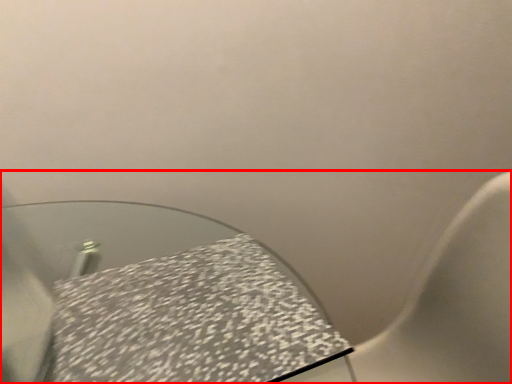
Question: From the image's perspective, where is toilet (annotated by the red box) located relative to tablecloth?

Choices:
 (A) below
 (B) above

Answer: (A)